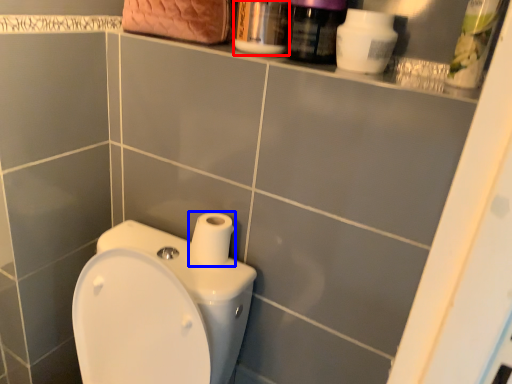
Question: Among these objects, which one is farthest to the camera, mouthwash (highlighted by a red box) or toilet paper (highlighted by a blue box)?

Choices:
 (A) mouthwash
 (B) toilet paper

Answer: (B)